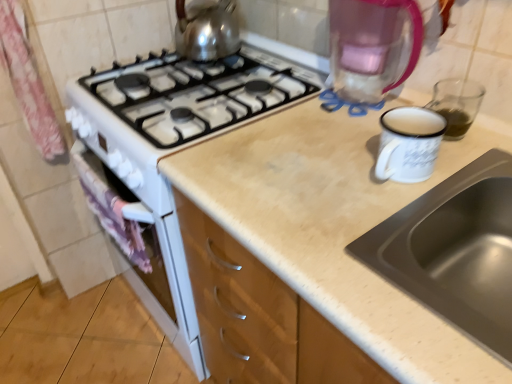
Question: Does pink fabric at left turn towards stainless steel sink at upper right?

Choices:
 (A) no
 (B) yes

Answer: (A)

Question: From a real-world perspective, is pink fabric at left over stainless steel sink at upper right?

Choices:
 (A) yes
 (B) no

Answer: (B)

Question: Is pink fabric at left far from stainless steel sink at upper right?

Choices:
 (A) no
 (B) yes

Answer: (A)

Question: Considering the relative sizes of pink fabric at left and stainless steel sink at upper right in the image provided, is pink fabric at left thinner than stainless steel sink at upper right?

Choices:
 (A) no
 (B) yes

Answer: (B)

Question: Are pink fabric at left and stainless steel sink at upper right beside each other?

Choices:
 (A) no
 (B) yes

Answer: (A)

Question: Does pink fabric at left have a smaller size compared to stainless steel sink at upper right?

Choices:
 (A) yes
 (B) no

Answer: (A)

Question: Are green liquid at right and transparent plastic coffeepot at upper right far apart?

Choices:
 (A) yes
 (B) no

Answer: (B)

Question: From the image's perspective, is green liquid at right over transparent plastic coffeepot at upper right?

Choices:
 (A) no
 (B) yes

Answer: (A)

Question: Is green liquid at right turned away from transparent plastic coffeepot at upper right?

Choices:
 (A) no
 (B) yes

Answer: (A)

Question: Is green liquid at right to the left of transparent plastic coffeepot at upper right from the viewer's perspective?

Choices:
 (A) no
 (B) yes

Answer: (A)

Question: Is green liquid at right positioned behind transparent plastic coffeepot at upper right?

Choices:
 (A) no
 (B) yes

Answer: (B)

Question: Is green liquid at right smaller than transparent plastic coffeepot at upper right?

Choices:
 (A) yes
 (B) no

Answer: (A)

Question: From a real-world perspective, is stainless steel sink at upper right on top of pink fabric curtain at left?

Choices:
 (A) no
 (B) yes

Answer: (A)